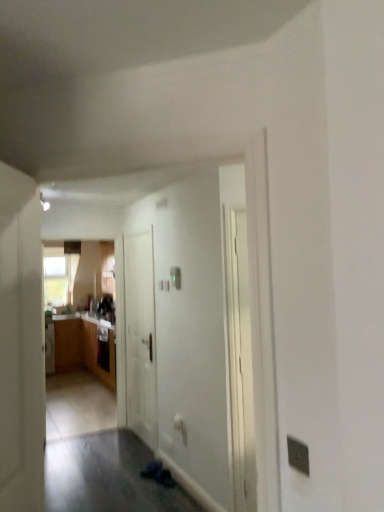
Question: Is white matte door at center, which appears as the 1th door when viewed from the back, at the left side of white matte door at left, arranged as the first door when viewed from the front?

Choices:
 (A) yes
 (B) no

Answer: (B)

Question: Does white matte door at center, acting as the 2th door starting from the front, have a lesser width compared to white matte door at left, arranged as the first door when viewed from the front?

Choices:
 (A) yes
 (B) no

Answer: (B)

Question: Is white matte door at center, which appears as the 1th door when viewed from the back, completely or partially outside of white matte door at left, arranged as the first door when viewed from the front?

Choices:
 (A) no
 (B) yes

Answer: (B)

Question: Can you confirm if white matte door at center, which appears as the 1th door when viewed from the back, is shorter than white matte door at left, arranged as the first door when viewed from the front?

Choices:
 (A) yes
 (B) no

Answer: (B)

Question: Does white matte door at center, which appears as the 1th door when viewed from the back, have a greater width compared to white matte door at left, arranged as the first door when viewed from the front?

Choices:
 (A) no
 (B) yes

Answer: (B)

Question: Choose the correct answer: Is wooden cabinet at left inside white matte door at left, arranged as the first door when viewed from the front, or outside it?

Choices:
 (A) outside
 (B) inside

Answer: (A)

Question: Considering the positions of wooden cabinet at left and white matte door at left, which is the 2th door in back-to-front order, in the image, is wooden cabinet at left wider or thinner than white matte door at left, which is the 2th door in back-to-front order,?

Choices:
 (A) thin
 (B) wide

Answer: (B)

Question: Considering their positions, is wooden cabinet at left located in front of or behind white matte door at left, arranged as the first door when viewed from the front?

Choices:
 (A) front
 (B) behind

Answer: (B)

Question: From the image's perspective, is wooden cabinet at left located above or below white matte door at left, which is the 2th door in back-to-front order?

Choices:
 (A) below
 (B) above

Answer: (A)

Question: From the image's perspective, is wooden cabinet at left positioned above or below white matte door at center, acting as the 2th door starting from the front?

Choices:
 (A) below
 (B) above

Answer: (A)

Question: Is wooden cabinet at left taller or shorter than white matte door at center, which appears as the 1th door when viewed from the back?

Choices:
 (A) short
 (B) tall

Answer: (A)

Question: Is point (79, 329) closer or farther from the camera than point (135, 428)?

Choices:
 (A) farther
 (B) closer

Answer: (A)

Question: Considering their positions, is wooden cabinet at left located in front of or behind white matte door at center, which appears as the 1th door when viewed from the back?

Choices:
 (A) behind
 (B) front

Answer: (A)

Question: Considering the positions of white matte door at center, acting as the 2th door starting from the front, and wooden cabinet at left in the image, is white matte door at center, acting as the 2th door starting from the front, taller or shorter than wooden cabinet at left?

Choices:
 (A) short
 (B) tall

Answer: (B)

Question: Considering the positions of point (147, 267) and point (64, 347), is point (147, 267) closer or farther from the camera than point (64, 347)?

Choices:
 (A) closer
 (B) farther

Answer: (A)